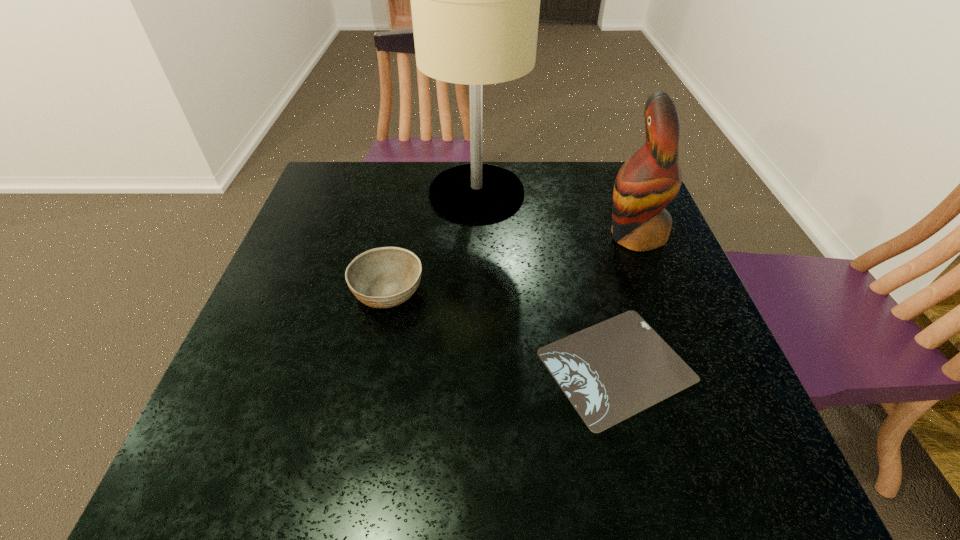
Locate an element on the screen. The width and height of the screenshot is (960, 540). vacant area in the image that satisfies the following two spatial constraints: 1. on the face of the second tallest object; 2. on the front side of the shortest object is located at coordinates (684, 365).

Find the location of a particular element. The width and height of the screenshot is (960, 540). free space that satisfies the following two spatial constraints: 1. on the face of the third shortest object; 2. on the front side of the second shortest object is located at coordinates (656, 291).

At what (x,y) coordinates should I click in order to perform the action: click on free space in the image that satisfies the following two spatial constraints: 1. on the front side of the tallest object; 2. on the left side of the mousepad. Please return your answer as a coordinate pair (x, y). Image resolution: width=960 pixels, height=540 pixels. Looking at the image, I should click on (475, 365).